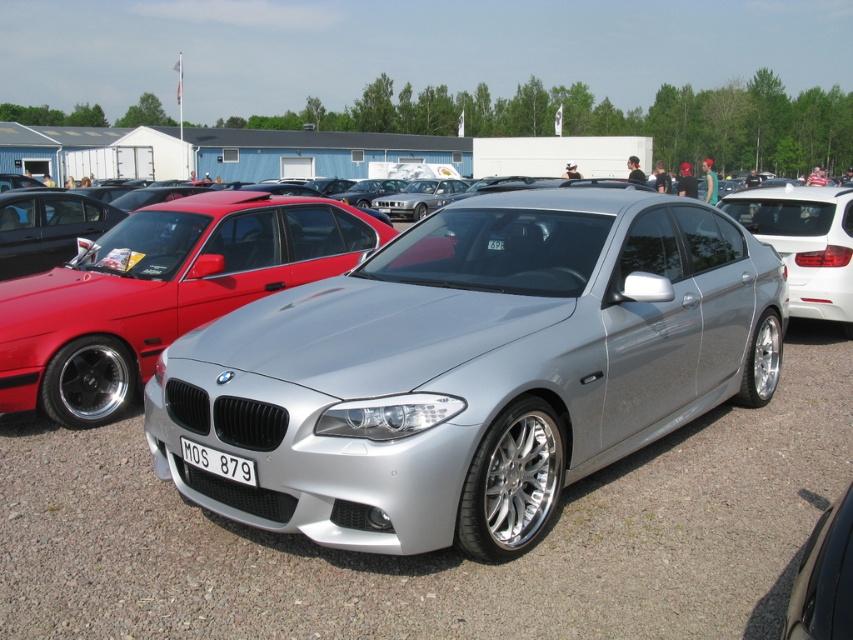
Is satin silver sedan at center positioned in front of white plastic license plate at front?

No, it is behind white plastic license plate at front.

Is point (828, 308) positioned in front of point (202, 458)?

No, it is not.

Who is more distant from viewer, (787, 269) or (233, 460)?

The point (787, 269) is more distant.

You are a GUI agent. You are given a task and a screenshot of the screen. Output one action in this format:
    pyautogui.click(x=<x>, y=<y>)
    Task: Click on the satin silver sedan at center
    
    Given the screenshot: What is the action you would take?
    pyautogui.click(x=805, y=243)

What do you see at coordinates (440, 550) in the screenshot? I see `silver metallic car at center` at bounding box center [440, 550].

Based on the photo, can you confirm if silver metallic car at center is taller than shiny red sports car at left?

Incorrect, silver metallic car at center's height is not larger of shiny red sports car at left's.

Is point (538, 563) positioned in front of point (143, 246)?

Yes, point (538, 563) is in front of point (143, 246).

Locate an element on the screen. silver metallic car at center is located at coordinates (440, 550).

Does shiny red sports car at left appear on the right side of white plastic license plate at front?

Incorrect, shiny red sports car at left is not on the right side of white plastic license plate at front.

Can you confirm if shiny red sports car at left is bigger than white plastic license plate at front?

Correct, shiny red sports car at left is larger in size than white plastic license plate at front.

Locate an element on the screen. Image resolution: width=853 pixels, height=640 pixels. shiny red sports car at left is located at coordinates (160, 291).